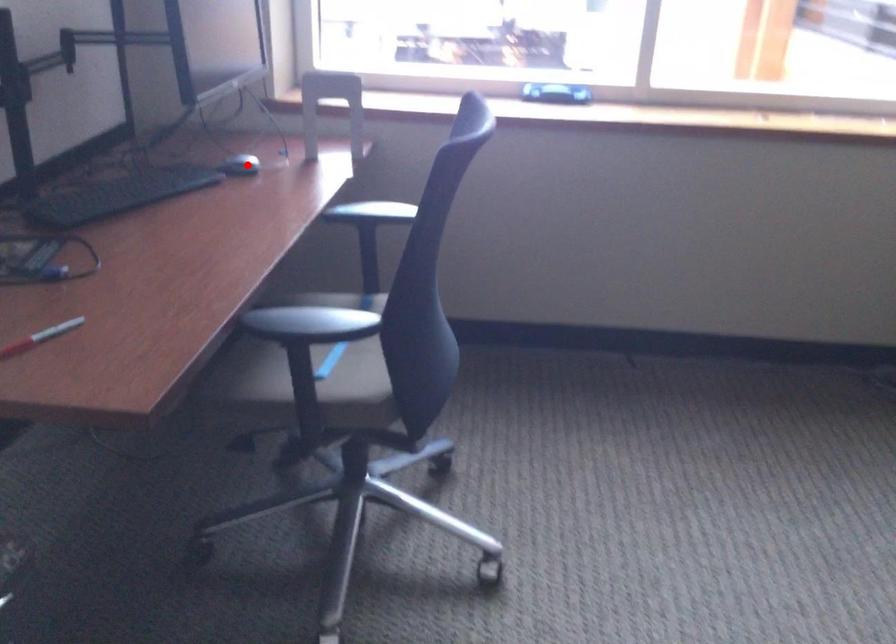
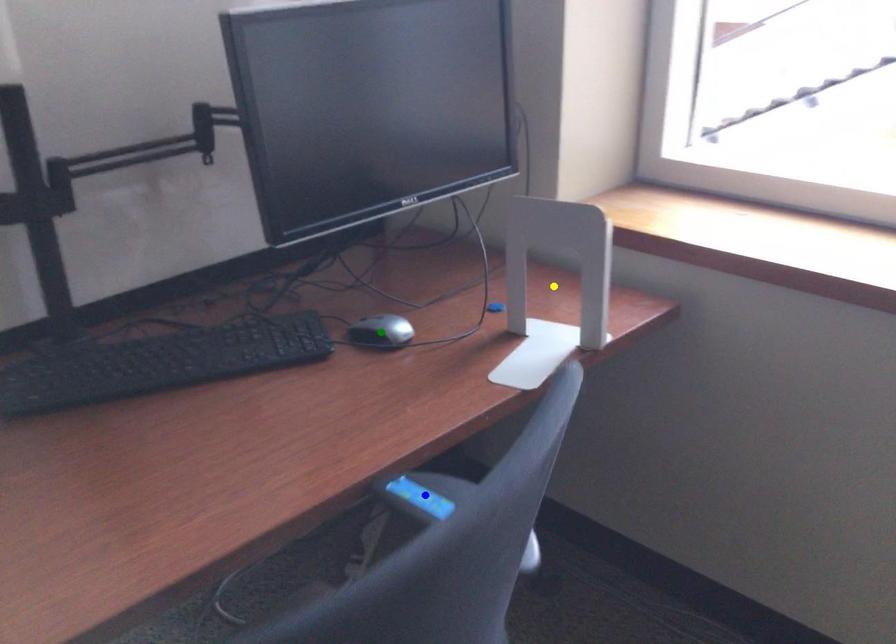
Question: I am providing you with two images of the same scene from different viewpoints. A red point is marked on the first image. You are given multiple points on the second image. Which mark in image 2 goes with the point in image 1?

Choices:
 (A) green point
 (B) yellow point
 (C) blue point

Answer: (A)